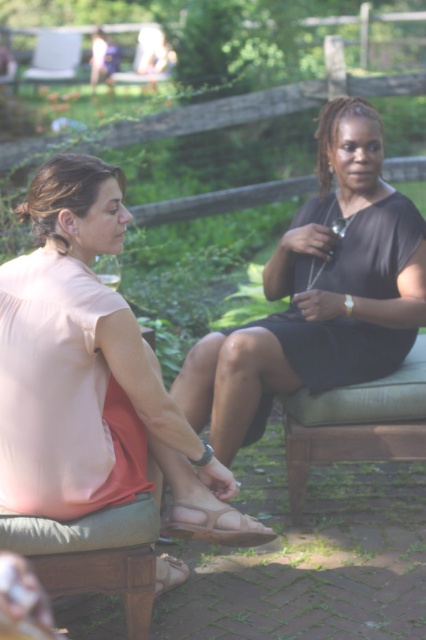
Does matte black dress at center appear on the right side of green fabric bench at center?

In fact, matte black dress at center is to the left of green fabric bench at center.

Is the position of matte black dress at center more distant than that of green fabric bench at center?

No, matte black dress at center is in front of green fabric bench at center.

Does point (204, 358) come farther from viewer compared to point (344, 449)?

No, it is not.

Locate an element on the screen. The image size is (426, 640). matte black dress at center is located at coordinates (319, 292).

Who is lower down, pink fabric blouse at left or green fabric bench at center?

green fabric bench at center is lower down.

Does pink fabric blouse at left have a lesser height compared to green fabric bench at center?

No, pink fabric blouse at left is not shorter than green fabric bench at center.

Find the location of a particular element. pink fabric blouse at left is located at coordinates (92, 374).

Does pink fabric blouse at left appear on the left side of matte black dress at center?

Yes, pink fabric blouse at left is to the left of matte black dress at center.

Between point (86, 316) and point (365, 355), which one is positioned behind?

The point (365, 355) is more distant.

Locate an element on the screen. The height and width of the screenshot is (640, 426). pink fabric blouse at left is located at coordinates (92, 374).